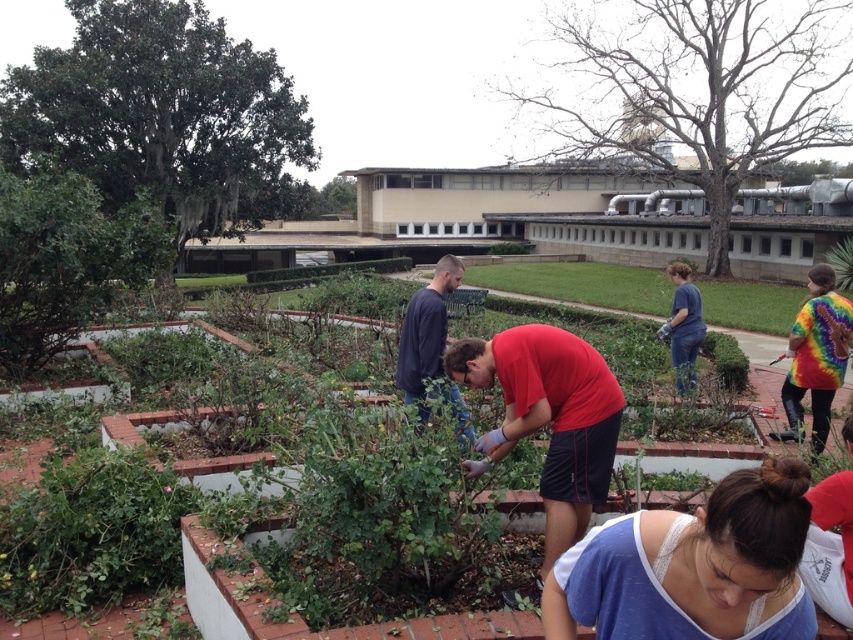
Is blue lace tank top at lower center closer to the viewer compared to green leafy plants at center?

Yes, it is.

Is blue lace tank top at lower center smaller than green leafy plants at center?

Correct, blue lace tank top at lower center occupies less space than green leafy plants at center.

Where is `blue lace tank top at lower center`? The height and width of the screenshot is (640, 853). blue lace tank top at lower center is located at coordinates (693, 566).

Does blue lace tank top at lower center appear over red matte shirt at center?

Actually, blue lace tank top at lower center is below red matte shirt at center.

Is point (740, 608) positioned in front of point (502, 376)?

Yes, it is in front of point (502, 376).

At what (x,y) coordinates should I click in order to perform the action: click on blue lace tank top at lower center. Please return your answer as a coordinate pair (x, y). Looking at the image, I should click on (693, 566).

Locate an element on the screen. blue lace tank top at lower center is located at coordinates (693, 566).

Is red matte shirt at center to the right of blue cotton shirt at center from the viewer's perspective?

Incorrect, red matte shirt at center is not on the right side of blue cotton shirt at center.

Consider the image. Who is more forward, (x=550, y=442) or (x=669, y=264)?

Point (x=550, y=442)

Locate an element on the screen. The image size is (853, 640). red matte shirt at center is located at coordinates (547, 417).